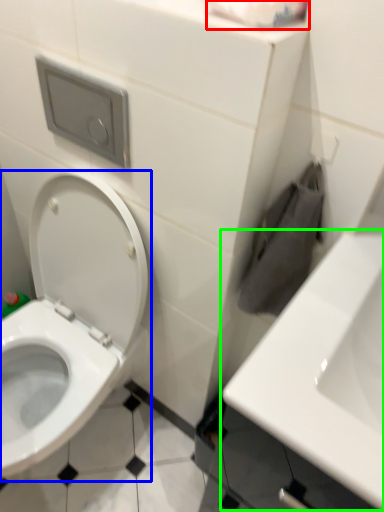
Question: Estimate the real-world distances between objects in this image. Which object is farther from toilet paper (highlighted by a red box), toilet (highlighted by a blue box) or sink (highlighted by a green box)?

Choices:
 (A) toilet
 (B) sink

Answer: (A)